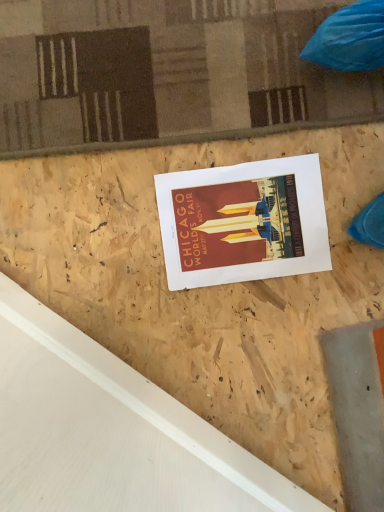
The height and width of the screenshot is (512, 384). What do you see at coordinates (243, 222) in the screenshot?
I see `matte paper poster at center` at bounding box center [243, 222].

In order to face matte paper poster at center, should I rotate leftwards or rightwards?

You should rotate right by 6.888 degrees.

Identify the location of matte paper poster at center. The width and height of the screenshot is (384, 512). (243, 222).

The width and height of the screenshot is (384, 512). Find the location of `matte paper poster at center`. matte paper poster at center is located at coordinates (243, 222).